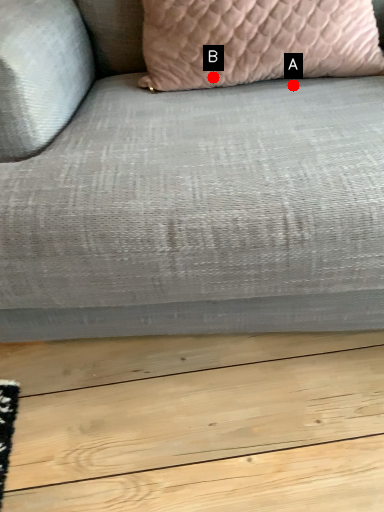
Question: Two points are circled on the image, labeled by A and B beside each circle. Which point is closer to the camera?

Choices:
 (A) A is closer
 (B) B is closer

Answer: (B)